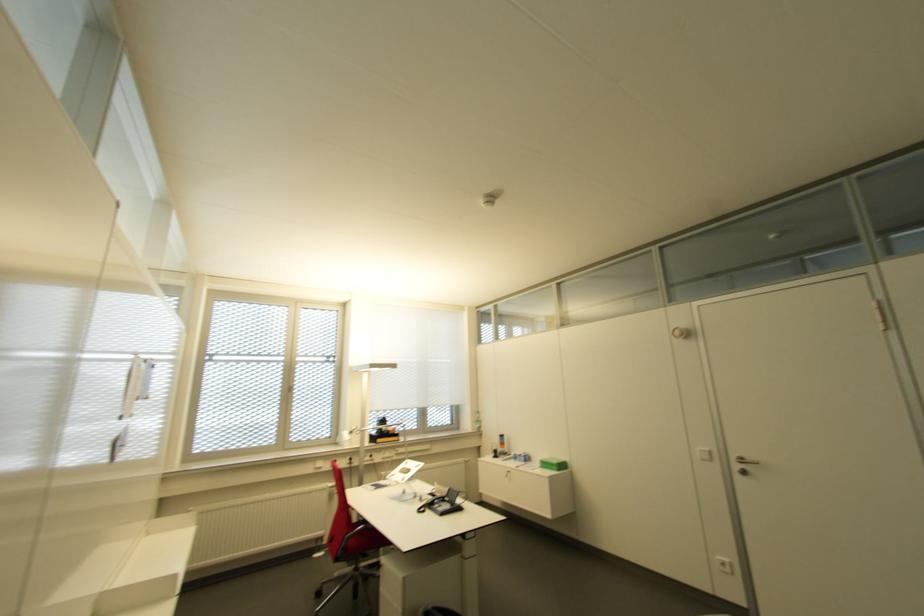
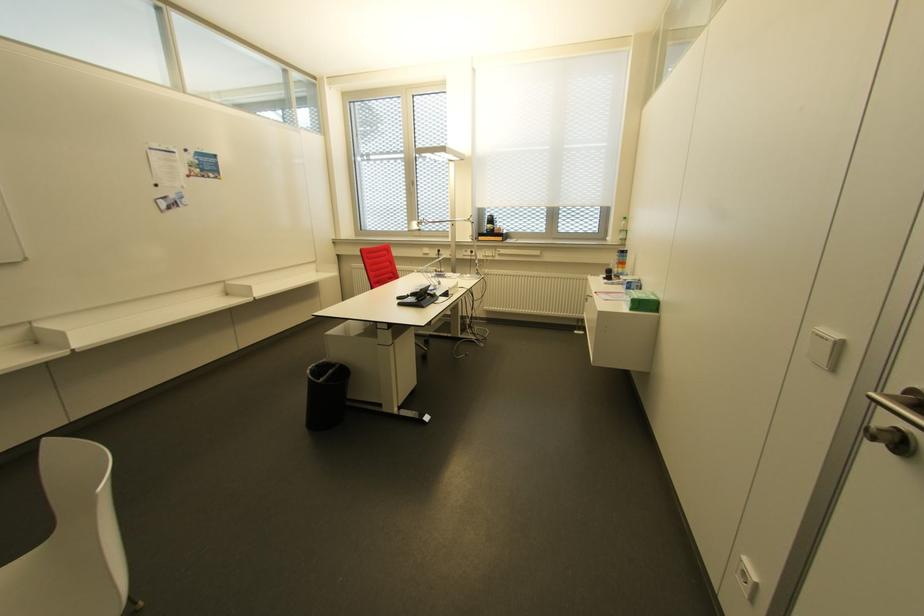
Find the pixel in the second image that matches (706,451) in the first image.

(833, 334)